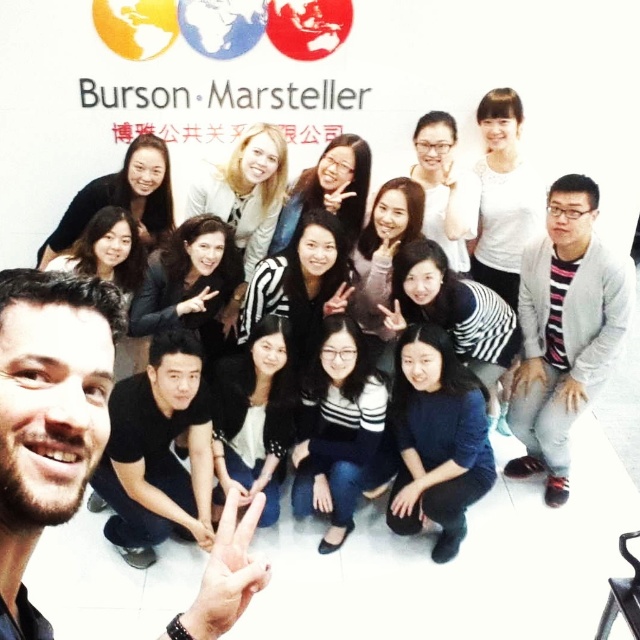
Looking at this image, you are a photographer trying to adjust the lighting for a group photo. You notice two people in the group wearing a gray striped sweater at lower right and a white matte shirt at upper right. Which person is standing to the right of the other?

The gray striped sweater at lower right is positioned on the right side of the white matte shirt at upper right, so the person wearing the gray striped sweater at lower right is to the right of the white matte shirt at upper right.

You are a photographer standing at the center of the group. You want to ensure that the gray striped sweater at lower right is in focus while capturing the group photo. Given that your camera has a depth of field range of 9 feet, will the sweater be in focus?

The gray striped sweater at lower right is 10.16 feet away from the camera. Since the depth of field range is 9 feet, the sweater is slightly out of the depth of field range. Therefore, it may not be in focus unless adjustments are made to the camera settings or the photographer moves closer.